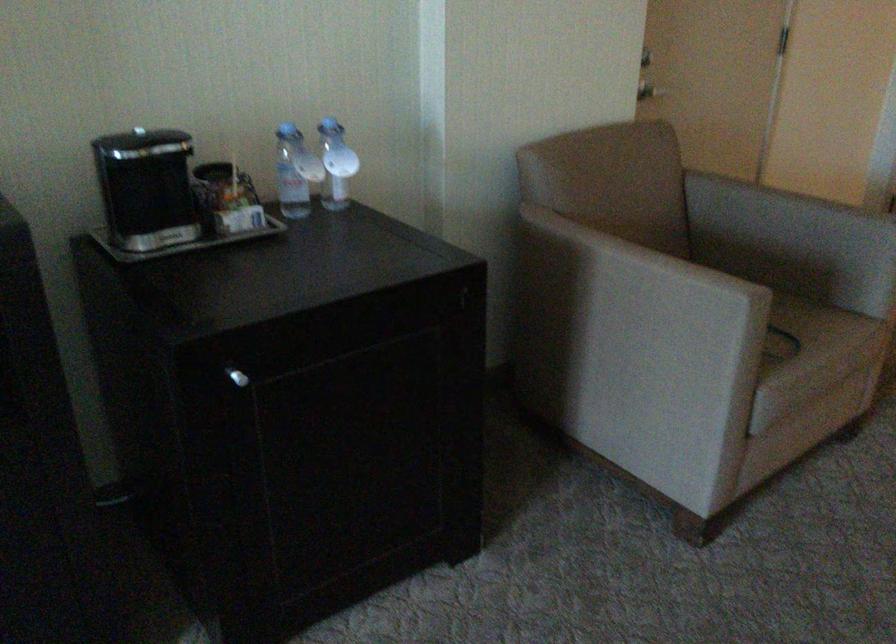
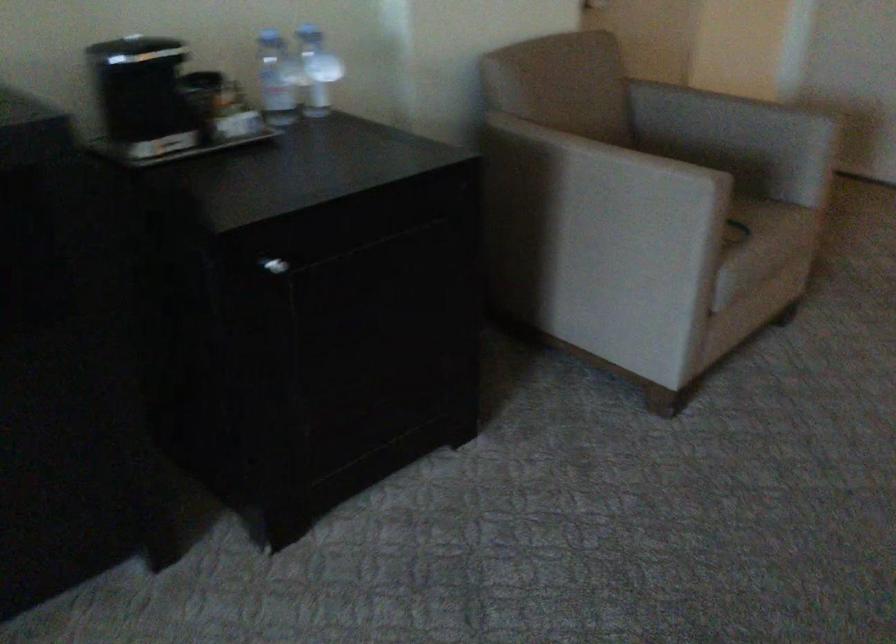
Which direction would the cameraman need to move to produce the second image?

The cameraman walked toward left, backward.